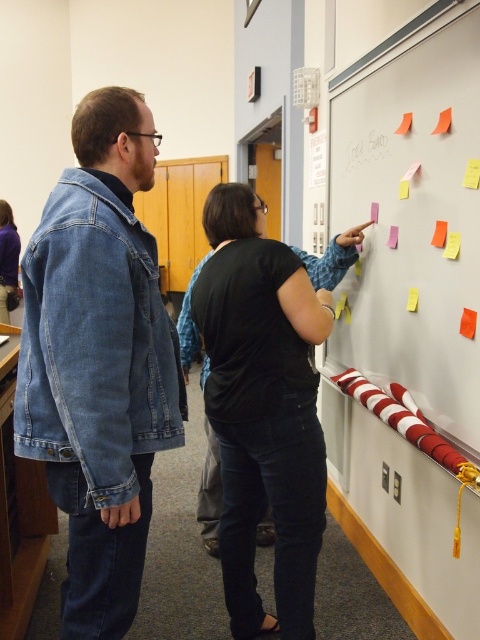
You are an observer in the room. You see the black matte shirt at center and the white paper at upper center. Which object is closer to the left side of the room?

The black matte shirt at center is positioned on the left side of white paper at upper center, so it is closer to the left side of the room.

You are an observer in the room. You notice the black matte shirt at center and the white paper at upper center. Which object is bigger in size?

The black matte shirt at center is larger in size compared to the white paper at upper center.

You are standing in the room and want to see the black matte shirt at center without moving your head. Can you see it clearly, or is it partially blocked by the multicolored sticky notes at upper right?

Result: The multicolored sticky notes at upper right are in front of the black matte shirt at center, so the black matte shirt at center is partially blocked and not fully visible.